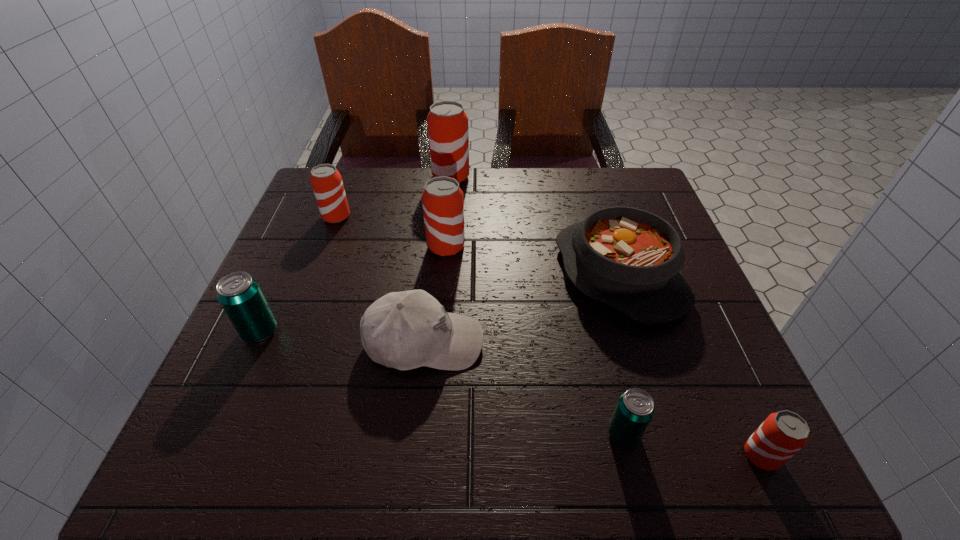
The height and width of the screenshot is (540, 960). I want to click on vacant region between the second nearest orange beer can and the left teal beer can, so click(x=353, y=289).

Locate an element on the screen. vacant area between the fifth shortest beer can and the fourth farthest beer can is located at coordinates (353, 289).

Select which object appears as the closest to the second farthest object. Please provide its 2D coordinates. Your answer should be formatted as a tuple, i.e. [(x, y)], where the tuple contains the x and y coordinates of a point satisfying the conditions above.

[(443, 204)]

Identify the location of object that is the third closest to the right teal beer can. The height and width of the screenshot is (540, 960). (405, 330).

Locate an element on the screen. This screenshot has width=960, height=540. the third closest beer can to the farther teal beer can is located at coordinates (448, 133).

Select which beer can is the third closest to the casserole. Please provide its 2D coordinates. Your answer should be formatted as a tuple, i.e. [(x, y)], where the tuple contains the x and y coordinates of a point satisfying the conditions above.

[(782, 434)]

Identify the location of orange beer can that is the third closest to the casserole. pyautogui.click(x=448, y=133).

Identify which orange beer can is the third nearest to the smaller teal beer can. Please provide its 2D coordinates. Your answer should be formatted as a tuple, i.e. [(x, y)], where the tuple contains the x and y coordinates of a point satisfying the conditions above.

[(448, 133)]

Find the location of a particular element. vacant space that satisfies the following two spatial constraints: 1. on the front-facing side of the baseball cap; 2. on the right side of the smaller teal beer can is located at coordinates (415, 434).

This screenshot has width=960, height=540. I want to click on vacant region that satisfies the following two spatial constraints: 1. on the front side of the fifth beer can from left to right; 2. on the right side of the seventh shortest object, so click(x=431, y=434).